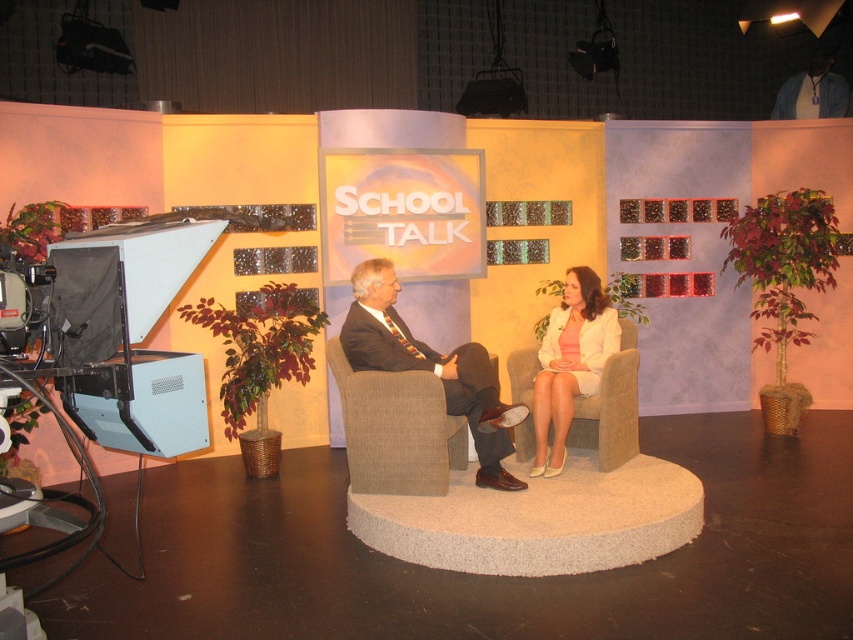
You are a stagehand in the studio and need to place a microphone stand exactly at the center of the beige fabric armchair at center. What coordinates should you aim for?

The beige fabric armchair at center is positioned at coordinates point (396,429), so the microphone stand should be placed at those exact coordinates.

You are a stagehand in the TV studio and need to place a microphone stand exactly at the center of the beige fabric armchair at center. What are the coordinates where you should position the microphone stand?

The beige fabric armchair at center is located at point (396, 429), so you should position the microphone stand at those coordinates to place it exactly at the center of the beige fabric armchair at center.

You are a stagehand who needs to place a 1.2 meter wide decorative panel between the matte black suit at center and the white fabric jacket at center. Is there enough space between them to fit the panel?

The distance between the matte black suit at center and the white fabric jacket at center is 63.01 centimeters. Since the panel is 1.2 meters wide, which is 120 centimeters, the space is insufficient to fit the panel.